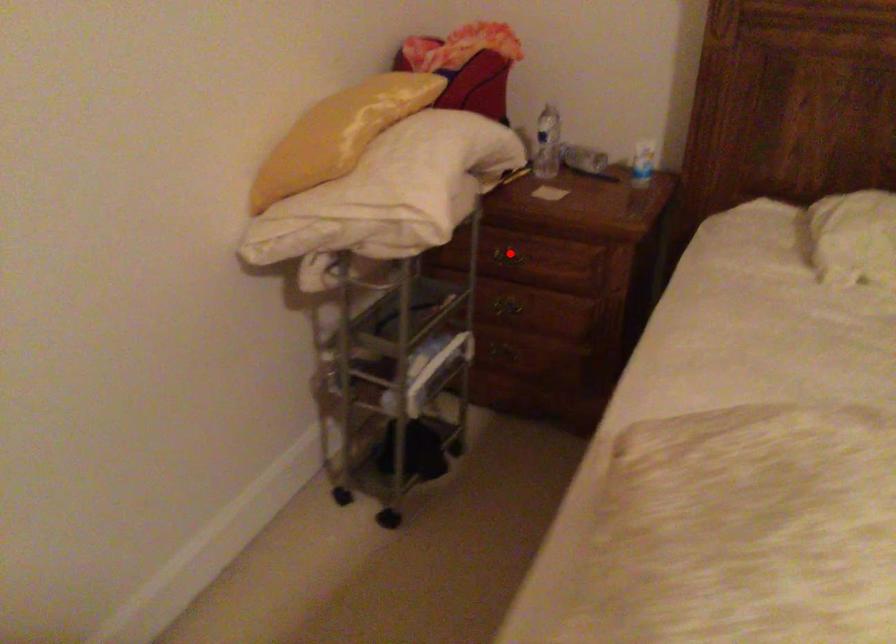
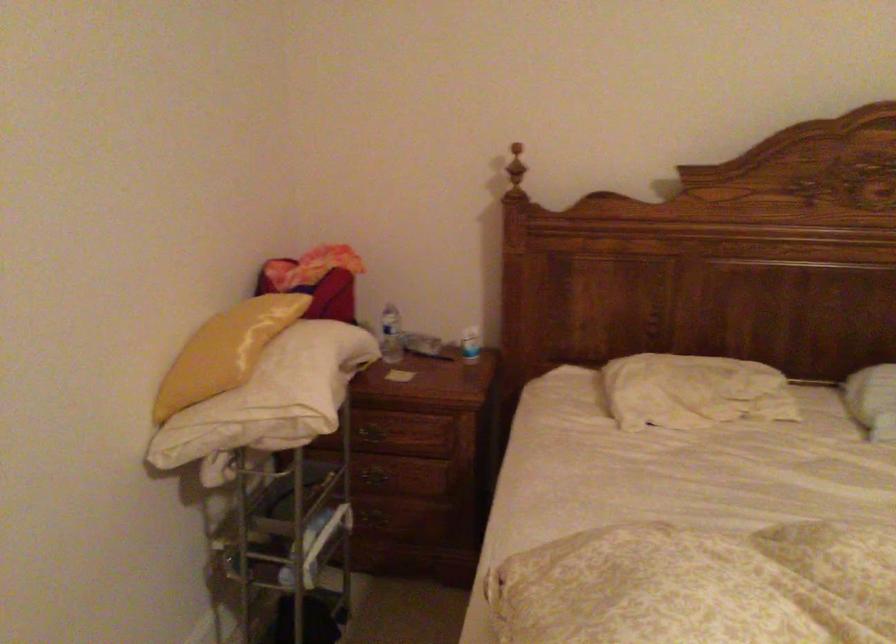
In the second image, find the point that corresponds to the highlighted location in the first image.

(374, 430)